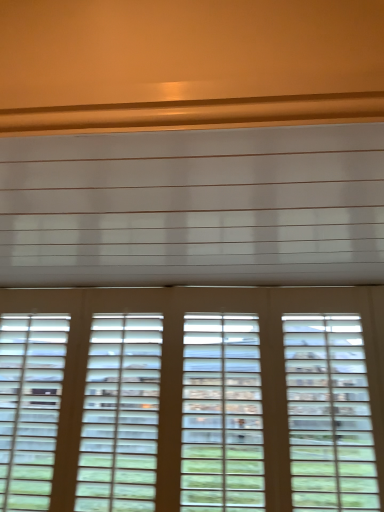
Question: From a real-world perspective, is wooden blinds at bottom over white matte blind at upper center?

Choices:
 (A) yes
 (B) no

Answer: (B)

Question: Does wooden blinds at bottom appear on the left side of white matte blind at upper center?

Choices:
 (A) yes
 (B) no

Answer: (B)

Question: Does wooden blinds at bottom come in front of white matte blind at upper center?

Choices:
 (A) no
 (B) yes

Answer: (A)

Question: From the image's perspective, is wooden blinds at bottom over white matte blind at upper center?

Choices:
 (A) yes
 (B) no

Answer: (B)

Question: Is wooden blinds at bottom oriented away from white matte blind at upper center?

Choices:
 (A) yes
 (B) no

Answer: (B)

Question: Considering the relative sizes of wooden blinds at bottom and white matte blind at upper center in the image provided, is wooden blinds at bottom taller than white matte blind at upper center?

Choices:
 (A) yes
 (B) no

Answer: (A)

Question: Is white matte blind at upper center positioned in front of wooden blinds at bottom?

Choices:
 (A) yes
 (B) no

Answer: (A)

Question: Considering the relative positions of white matte blind at upper center and wooden blinds at bottom in the image provided, is white matte blind at upper center to the left of wooden blinds at bottom from the viewer's perspective?

Choices:
 (A) yes
 (B) no

Answer: (A)

Question: From a real-world perspective, is white matte blind at upper center on top of wooden blinds at bottom?

Choices:
 (A) no
 (B) yes

Answer: (B)

Question: Is white matte blind at upper center further to camera compared to wooden blinds at bottom?

Choices:
 (A) no
 (B) yes

Answer: (A)

Question: Does white matte blind at upper center contain wooden blinds at bottom?

Choices:
 (A) yes
 (B) no

Answer: (B)

Question: Is white matte blind at upper center outside wooden blinds at bottom?

Choices:
 (A) no
 (B) yes

Answer: (B)

Question: Does point click(x=201, y=238) appear closer or farther from the camera than point click(x=294, y=490)?

Choices:
 (A) closer
 (B) farther

Answer: (A)